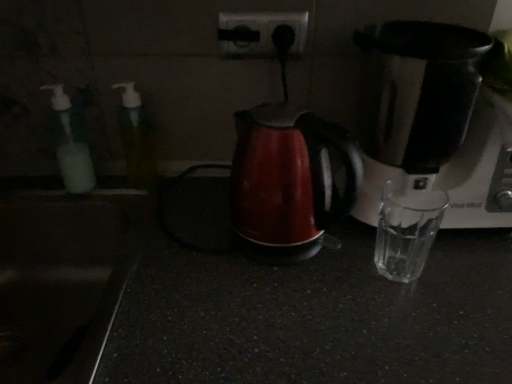
Question: Is translucent plastic soap dispenser at left, the 2th bottle positioned from the right, oriented away from translucent plastic bottle at left, which appears as the second bottle when viewed from the left?

Choices:
 (A) no
 (B) yes

Answer: (A)

Question: Is translucent plastic soap dispenser at left, the 2th bottle positioned from the right, bigger than translucent plastic bottle at left, placed as the first bottle when sorted from right to left?

Choices:
 (A) yes
 (B) no

Answer: (B)

Question: Is translucent plastic bottle at left, placed as the first bottle when sorted from right to left, surrounded by translucent plastic soap dispenser at left, the 2th bottle positioned from the right?

Choices:
 (A) yes
 (B) no

Answer: (B)

Question: Is translucent plastic soap dispenser at left, the 1th bottle viewed from the left, positioned in front of translucent plastic bottle at left, placed as the first bottle when sorted from right to left?

Choices:
 (A) yes
 (B) no

Answer: (B)

Question: Is translucent plastic soap dispenser at left, the 1th bottle viewed from the left, taller than translucent plastic bottle at left, placed as the first bottle when sorted from right to left?

Choices:
 (A) no
 (B) yes

Answer: (A)

Question: From a real-world perspective, is translucent plastic soap dispenser at left, the 2th bottle positioned from the right, on top of translucent plastic bottle at left, placed as the first bottle when sorted from right to left?

Choices:
 (A) no
 (B) yes

Answer: (A)

Question: Does black glossy sink at lower left have a greater width compared to satin black coffee maker at right?

Choices:
 (A) yes
 (B) no

Answer: (A)

Question: Is black glossy sink at lower left thinner than satin black coffee maker at right?

Choices:
 (A) yes
 (B) no

Answer: (B)

Question: From a real-world perspective, is black glossy sink at lower left physically below satin black coffee maker at right?

Choices:
 (A) no
 (B) yes

Answer: (B)

Question: Is black glossy sink at lower left with satin black coffee maker at right?

Choices:
 (A) no
 (B) yes

Answer: (A)

Question: Is black glossy sink at lower left not within satin black coffee maker at right?

Choices:
 (A) yes
 (B) no

Answer: (A)

Question: Is black glossy sink at lower left not near satin black coffee maker at right?

Choices:
 (A) yes
 (B) no

Answer: (B)

Question: Is satin black coffee maker at right outside of translucent plastic soap dispenser at left, the 2th bottle positioned from the right?

Choices:
 (A) no
 (B) yes

Answer: (B)